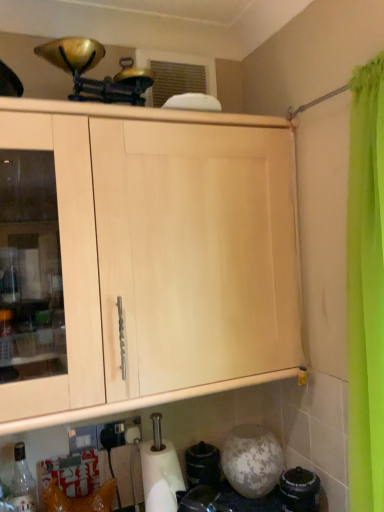
Question: In the image, is white matte paper towel at lower center on the left side or the right side of translucent glass bottle at lower left?

Choices:
 (A) left
 (B) right

Answer: (B)

Question: Is point (147, 482) positioned closer to the camera than point (18, 495)?

Choices:
 (A) closer
 (B) farther

Answer: (B)

Question: From the image's perspective, relative to translucent glass bottle at lower left, is white matte paper towel at lower center above or below?

Choices:
 (A) below
 (B) above

Answer: (B)

Question: Would you say translucent glass bottle at lower left is to the left or to the right of white matte paper towel at lower center in the picture?

Choices:
 (A) left
 (B) right

Answer: (A)

Question: Considering their positions, is translucent glass bottle at lower left located in front of or behind white matte paper towel at lower center?

Choices:
 (A) behind
 (B) front

Answer: (B)

Question: From the image's perspective, relative to white matte paper towel at lower center, is translucent glass bottle at lower left above or below?

Choices:
 (A) below
 (B) above

Answer: (A)

Question: Considering the positions of translucent glass bottle at lower left and white matte paper towel at lower center in the image, is translucent glass bottle at lower left wider or thinner than white matte paper towel at lower center?

Choices:
 (A) thin
 (B) wide

Answer: (A)